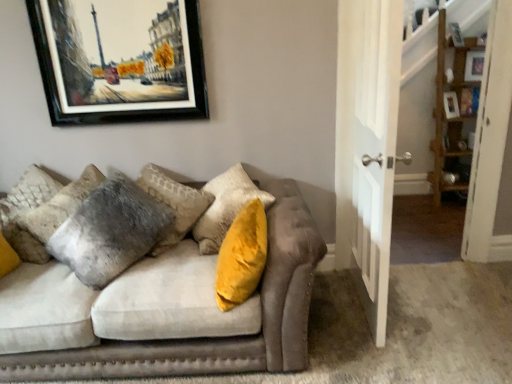
Question: Is wooden shelf at right inside the boundaries of velvet gray couch at center, or outside?

Choices:
 (A) outside
 (B) inside

Answer: (A)

Question: Looking at the image, does wooden shelf at right seem bigger or smaller compared to velvet gray couch at center?

Choices:
 (A) big
 (B) small

Answer: (B)

Question: Estimate the real-world distances between objects in this image. Which object is closer to the wooden shelf at right?

Choices:
 (A) velvet gray couch at center
 (B) black matte picture frame at upper left
 (C) velvet gray pillow at left
 (D) white wooden door at center

Answer: (D)

Question: Which object is the closest to the black matte picture frame at upper left?

Choices:
 (A) velvet gray pillow at left
 (B) velvet gray couch at center
 (C) white wooden door at center
 (D) wooden shelf at right

Answer: (A)